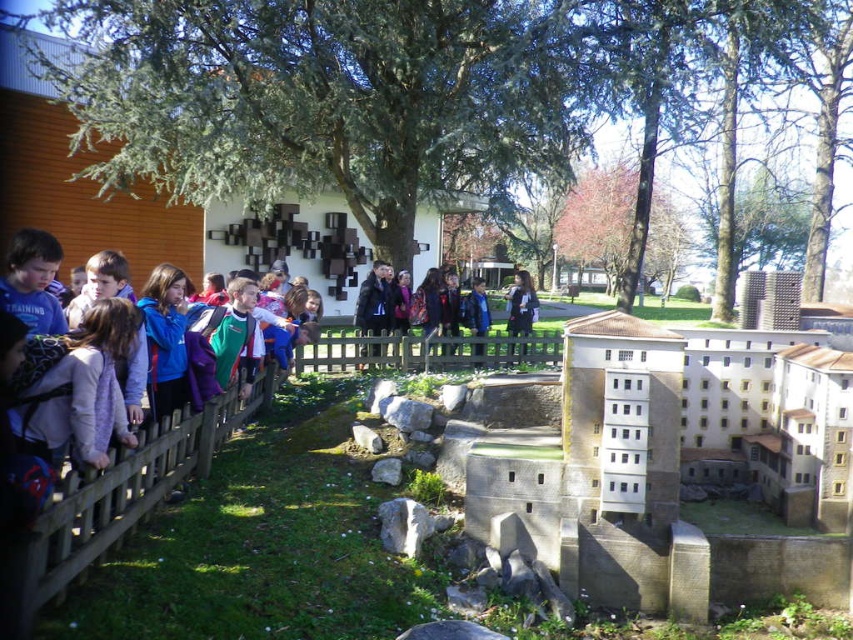
You are a student on a field trip and want to walk from the brown wooden fence at left to the brown wooden fence at center. Can you walk through the space between them?

The brown wooden fence at left is narrower than the brown wooden fence at center, but since both are fences, there might not be a clear path between them. Check if there is an opening or gap before attempting to walk through.

You are standing in the outdoor area where the children are observing the model. If you want to see the brown wooden fence at left, where should you look?

You should look at point (128, 490) to see the brown wooden fence at left.

You are a student on a field trip and want to get a better view of the historical model. You notice two sections of the brown wooden fence at left and brown wooden fence at center. Which fence section should you move closer to in order to see the model more clearly?

The brown wooden fence at left is much taller than the brown wooden fence at center, so moving closer to the shorter brown wooden fence at center will provide a better view of the model.